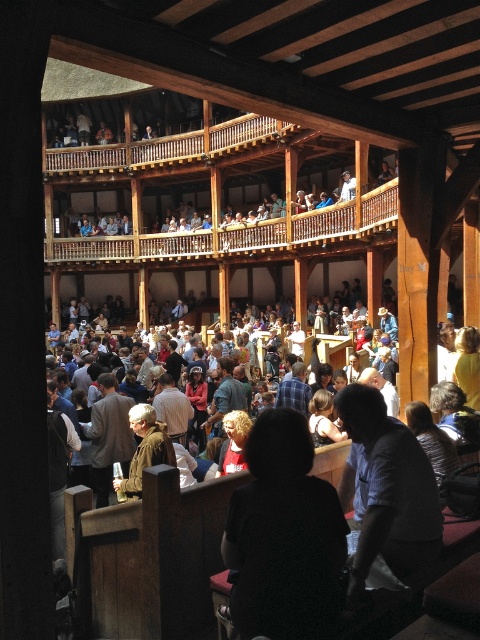
You are standing in the theater and see the blue shirt at lower right. If you want to throw a small note to them, would you need to walk closer to ensure it reaches them?

The blue shirt at lower right and viewer are 73.14 feet apart from each other, so you would need to walk closer to ensure the note reaches them.

You are a stagehand in the theater who needs to place a 100 feet long banner between the blue shirt at lower right and the plaid shirt at center. Is there enough space to stretch the banner between them?

The blue shirt at lower right and plaid shirt at center are 80.91 feet apart from each other. Since the banner is 100 feet long, which is longer than the distance between them, there is not enough space to stretch the banner between them.